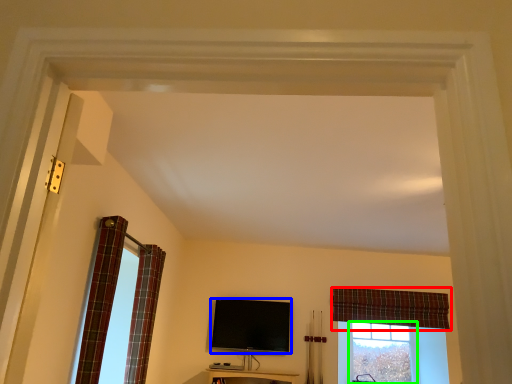
Question: Considering the real-world distances, which object is closest to curtain (highlighted by a red box)? television (highlighted by a blue box) or bay window (highlighted by a green box).

Choices:
 (A) television
 (B) bay window

Answer: (B)